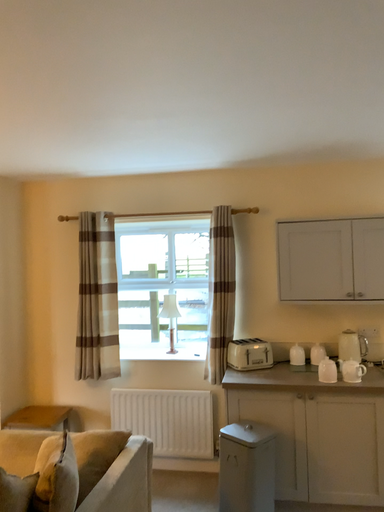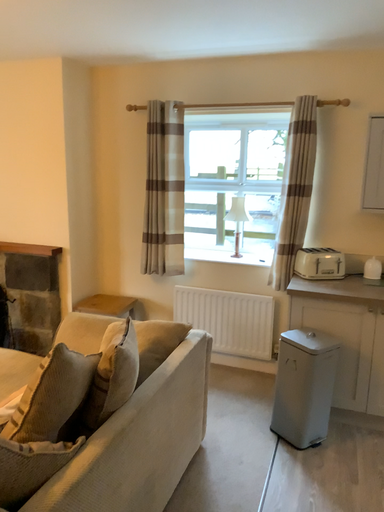
Question: Which way did the camera rotate in the video?

Choices:
 (A) rotated upward
 (B) rotated downward

Answer: (B)